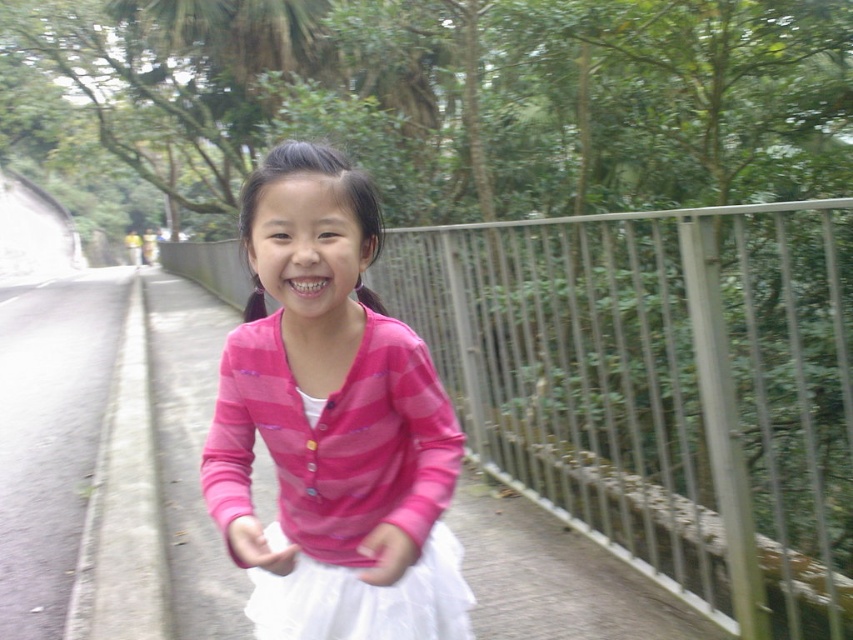
Question: Among these points, which one is nearest to the camera?

Choices:
 (A) (373, 605)
 (B) (561, 483)

Answer: (A)

Question: Is metallic gray rail at center thinner than pink striped sweater at center?

Choices:
 (A) yes
 (B) no

Answer: (B)

Question: Which object appears closest to the camera in this image?

Choices:
 (A) metallic gray rail at center
 (B) pink striped sweater at center

Answer: (B)

Question: Is metallic gray rail at center positioned before pink striped sweater at center?

Choices:
 (A) yes
 (B) no

Answer: (B)

Question: Does metallic gray rail at center come behind pink striped sweater at center?

Choices:
 (A) no
 (B) yes

Answer: (B)